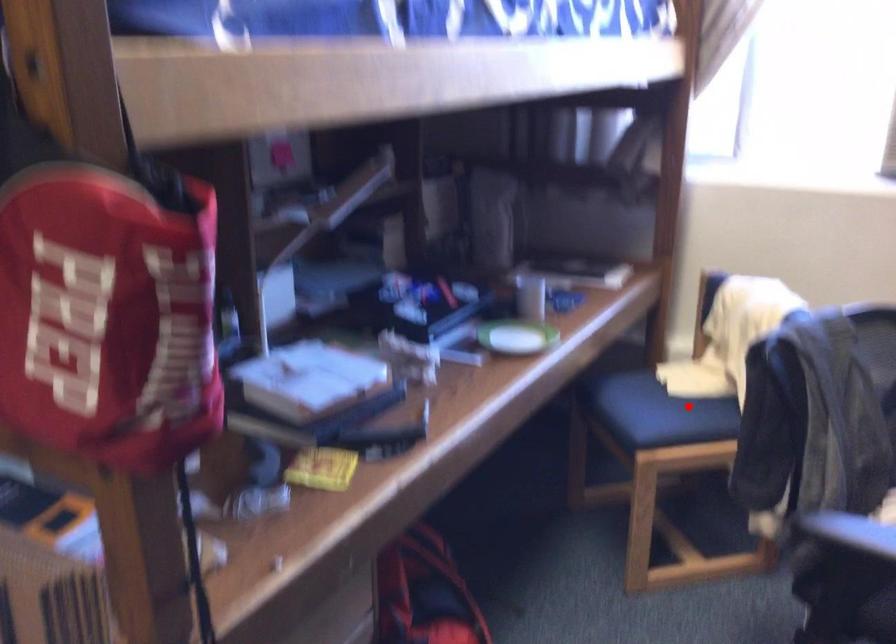
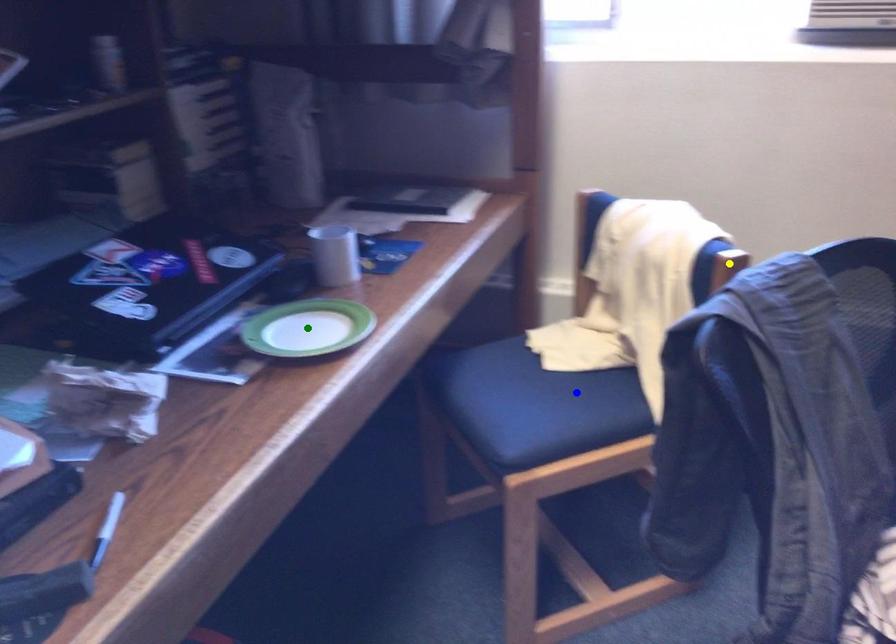
Question: I am providing you with two images of the same scene from different viewpoints. A red point is marked on the first image. You are given multiple points on the second image. Which mark in image 2 goes with the point in image 1?

Choices:
 (A) yellow point
 (B) blue point
 (C) green point

Answer: (B)